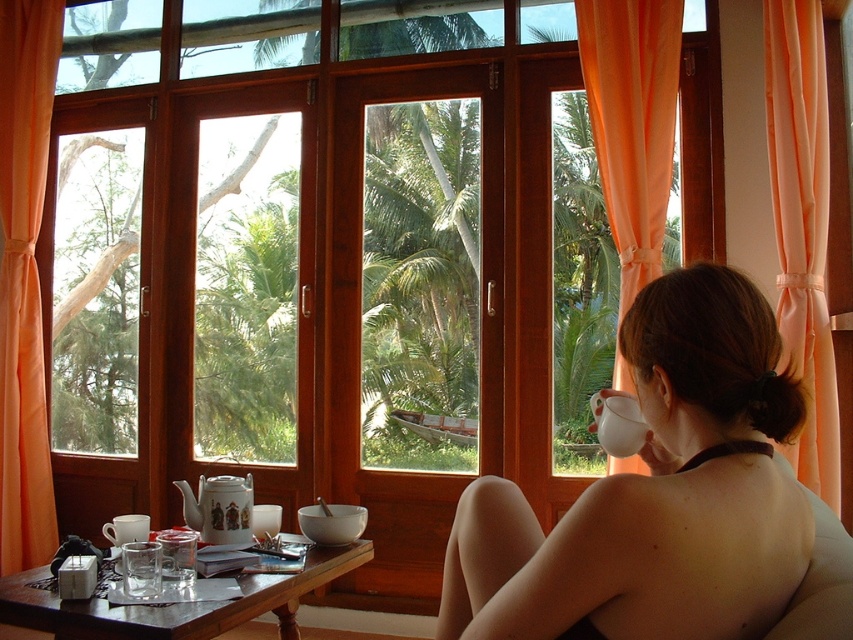
Who is more forward, (x=817, y=83) or (x=625, y=413)?

Point (x=625, y=413) is in front.

The width and height of the screenshot is (853, 640). What do you see at coordinates (802, 228) in the screenshot? I see `peach satin curtain at right` at bounding box center [802, 228].

Where is `peach satin curtain at right`? peach satin curtain at right is located at coordinates (802, 228).

Does orange fabric curtain at right have a lesser height compared to white matte cup at upper right?

No.

Who is shorter, orange fabric curtain at right or white matte cup at upper right?

white matte cup at upper right is shorter.

I want to click on orange fabric curtain at right, so click(x=631, y=122).

I want to click on orange fabric curtain at right, so click(631, 122).

From the picture: Which is below, orange fabric curtain at right or transparent glass cup at lower left?

Positioned lower is transparent glass cup at lower left.

Between orange fabric curtain at right and transparent glass cup at lower left, which one has less height?

Standing shorter between the two is transparent glass cup at lower left.

Which is behind, point (668, 106) or point (132, 554)?

The point (668, 106) is more distant.

This screenshot has height=640, width=853. What are the coordinates of `orange fabric curtain at right` in the screenshot? It's located at (631, 122).